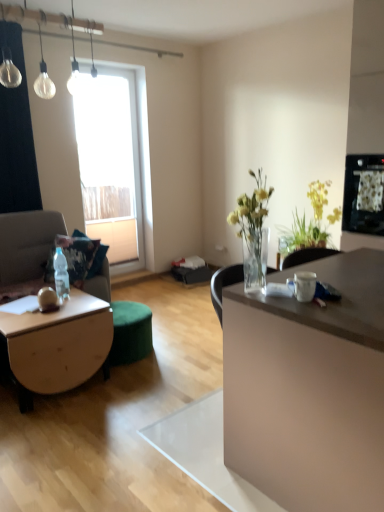
Question: Is clear glass light bulb at upper left at the back of yellow-green leafy plant at upper right?

Choices:
 (A) yes
 (B) no

Answer: (B)

Question: Is yellow-green leafy plant at upper right facing towards clear glass light bulb at upper left?

Choices:
 (A) yes
 (B) no

Answer: (A)

Question: From a real-world perspective, is yellow-green leafy plant at upper right located beneath clear glass light bulb at upper left?

Choices:
 (A) yes
 (B) no

Answer: (A)

Question: Considering the relative sizes of yellow-green leafy plant at upper right and clear glass light bulb at upper left in the image provided, is yellow-green leafy plant at upper right thinner than clear glass light bulb at upper left?

Choices:
 (A) no
 (B) yes

Answer: (B)

Question: From a real-world perspective, is yellow-green leafy plant at upper right over clear glass light bulb at upper left?

Choices:
 (A) no
 (B) yes

Answer: (A)

Question: Visually, is clear glass light bulb at upper left positioned to the left or to the right of transparent glass window at upper left?

Choices:
 (A) right
 (B) left

Answer: (A)

Question: Looking at the image, does clear glass light bulb at upper left seem bigger or smaller compared to transparent glass window at upper left?

Choices:
 (A) big
 (B) small

Answer: (B)

Question: From the image's perspective, is clear glass light bulb at upper left above or below transparent glass window at upper left?

Choices:
 (A) below
 (B) above

Answer: (B)

Question: Is clear glass light bulb at upper left in front of or behind transparent glass window at upper left in the image?

Choices:
 (A) front
 (B) behind

Answer: (A)

Question: Considering their positions, is white glossy mug at center located in front of or behind matte white desk at right?

Choices:
 (A) behind
 (B) front

Answer: (A)

Question: From the image's perspective, is white glossy mug at center located above or below matte white desk at right?

Choices:
 (A) above
 (B) below

Answer: (A)

Question: Is white glossy mug at center bigger or smaller than matte white desk at right?

Choices:
 (A) big
 (B) small

Answer: (B)

Question: Is point (288, 281) closer or farther from the camera than point (352, 472)?

Choices:
 (A) closer
 (B) farther

Answer: (B)

Question: From the image's perspective, is clear glass light bulb at upper left above or below yellow-green leafy plant at upper right?

Choices:
 (A) above
 (B) below

Answer: (A)

Question: Is clear glass light bulb at upper left inside the boundaries of yellow-green leafy plant at upper right, or outside?

Choices:
 (A) outside
 (B) inside

Answer: (A)